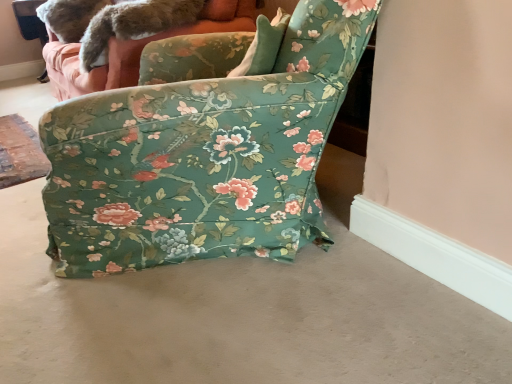
At what (x,y) coordinates should I click in order to perform the action: click on floral fabric couch at upper center. Please return your answer as a coordinate pair (x, y). Image resolution: width=512 pixels, height=384 pixels. Looking at the image, I should click on (x=145, y=45).

Image resolution: width=512 pixels, height=384 pixels. Describe the element at coordinates (237, 317) in the screenshot. I see `beige carpet at lower center` at that location.

You are a GUI agent. You are given a task and a screenshot of the screen. Output one action in this format:
    pyautogui.click(x=<x>, y=<y>)
    Task: Click on the floral fabric couch at upper center
    Image resolution: width=512 pixels, height=384 pixels.
    Given the screenshot: What is the action you would take?
    pyautogui.click(x=145, y=45)

At what (x,y) coordinates should I click in order to perform the action: click on animal behind the floral fabric chair at center. Please return your answer as a coordinate pair (x, y). The height and width of the screenshot is (384, 512). Looking at the image, I should click on (113, 21).

Can you confirm if fuzzy fur tail at upper left is positioned to the right of floral fabric chair at center?

No.

Does fuzzy fur tail at upper left lie behind floral fabric chair at center?

Yes, fuzzy fur tail at upper left is behind floral fabric chair at center.

Could you tell me if fuzzy fur tail at upper left is facing floral fabric chair at center?

No, fuzzy fur tail at upper left does not turn towards floral fabric chair at center.

Considering the relative positions of fuzzy fur tail at upper left and floral fabric couch at upper center in the image provided, is fuzzy fur tail at upper left to the left or to the right of floral fabric couch at upper center?

fuzzy fur tail at upper left is positioned on floral fabric couch at upper center's right side.

From the image's perspective, would you say fuzzy fur tail at upper left is shown under floral fabric couch at upper center?

Yes, from the image's perspective, fuzzy fur tail at upper left is beneath floral fabric couch at upper center.

What's the angular difference between fuzzy fur tail at upper left and floral fabric couch at upper center's facing directions?

The angular difference between fuzzy fur tail at upper left and floral fabric couch at upper center is 10.9 degrees.

At what (x,y) coordinates should I click in order to perform the action: click on couch on the left of the fuzzy fur tail at upper left. Please return your answer as a coordinate pair (x, y). This screenshot has height=384, width=512. Looking at the image, I should click on (145, 45).

Where is `concrete located in front of the fuzzy fur tail at upper left`? The width and height of the screenshot is (512, 384). concrete located in front of the fuzzy fur tail at upper left is located at coordinates (237, 317).

Based on the photo, considering the relative sizes of fuzzy fur tail at upper left and beige carpet at lower center in the image provided, is fuzzy fur tail at upper left shorter than beige carpet at lower center?

In fact, fuzzy fur tail at upper left may be taller than beige carpet at lower center.

Does fuzzy fur tail at upper left appear on the right side of beige carpet at lower center?

Incorrect, fuzzy fur tail at upper left is not on the right side of beige carpet at lower center.

Which is in front, point (157, 2) or point (362, 273)?

The point (362, 273) is closer.

From the image's perspective, relative to floral fabric chair at center, is beige carpet at lower center above or below?

beige carpet at lower center is below floral fabric chair at center.

Can you confirm if beige carpet at lower center is thinner than floral fabric chair at center?

Correct, the width of beige carpet at lower center is less than that of floral fabric chair at center.

Is beige carpet at lower center outside of floral fabric chair at center?

beige carpet at lower center is positioned outside floral fabric chair at center.

Is floral fabric chair at center wider than floral fabric couch at upper center?

Yes, floral fabric chair at center is wider than floral fabric couch at upper center.

Does point (178, 140) appear closer or farther from the camera than point (83, 86)?

Clearly, point (178, 140) is closer to the camera than point (83, 86).

Consider the image. From a real-world perspective, which is physically above, floral fabric chair at center or floral fabric couch at upper center?

From a 3D spatial view, floral fabric chair at center is above.

Between floral fabric couch at upper center and beige carpet at lower center, which one has larger size?

floral fabric couch at upper center.

Is beige carpet at lower center at the back of floral fabric couch at upper center?

No, floral fabric couch at upper center is not facing away from beige carpet at lower center.

How different are the orientations of floral fabric couch at upper center and beige carpet at lower center in degrees?

There is a 94.7-degree angle between the facing directions of floral fabric couch at upper center and beige carpet at lower center.

Is floral fabric couch at upper center touching beige carpet at lower center?

No, floral fabric couch at upper center is not beside beige carpet at lower center.

Considering the relative sizes of beige carpet at lower center and fuzzy fur tail at upper left in the image provided, is beige carpet at lower center wider than fuzzy fur tail at upper left?

Yes.

Where is `animal behind the beige carpet at lower center`? animal behind the beige carpet at lower center is located at coordinates (113, 21).

Is beige carpet at lower center far from fuzzy fur tail at upper left?

beige carpet at lower center is far away from fuzzy fur tail at upper left.

Is beige carpet at lower center situated inside fuzzy fur tail at upper left or outside?

beige carpet at lower center cannot be found inside fuzzy fur tail at upper left.

You are a GUI agent. You are given a task and a screenshot of the screen. Output one action in this format:
    pyautogui.click(x=<x>, y=<y>)
    Task: Click on the animal behind the floral fabric chair at center
    This screenshot has width=512, height=384.
    Given the screenshot: What is the action you would take?
    click(113, 21)

Where is `animal below the floral fabric couch at upper center (from the image's perspective)`? The image size is (512, 384). animal below the floral fabric couch at upper center (from the image's perspective) is located at coordinates (113, 21).

Considering their positions, is fuzzy fur tail at upper left positioned further to floral fabric chair at center than floral fabric couch at upper center?

Among the two, fuzzy fur tail at upper left is located further to floral fabric chair at center.

Looking at the image, which one is located closer to beige carpet at lower center, floral fabric chair at center or floral fabric couch at upper center?

The object closer to beige carpet at lower center is floral fabric chair at center.

Which object lies nearer to the anchor point fuzzy fur tail at upper left, beige carpet at lower center or floral fabric couch at upper center?

Among the two, floral fabric couch at upper center is located nearer to fuzzy fur tail at upper left.

From the image, which object appears to be nearer to floral fabric couch at upper center, fuzzy fur tail at upper left or beige carpet at lower center?

fuzzy fur tail at upper left is positioned closer to the anchor floral fabric couch at upper center.

Looking at the image, which one is located further to beige carpet at lower center, floral fabric couch at upper center or fuzzy fur tail at upper left?

fuzzy fur tail at upper left is further to beige carpet at lower center.

Based on the photo, when comparing their distances from floral fabric couch at upper center, does beige carpet at lower center or floral fabric chair at center seem closer?

floral fabric chair at center lies closer to floral fabric couch at upper center than the other object.

Estimate the real-world distances between objects in this image. Which object is closer to beige carpet at lower center, fuzzy fur tail at upper left or floral fabric couch at upper center?

floral fabric couch at upper center lies closer to beige carpet at lower center than the other object.

From the image, which object appears to be farther from floral fabric couch at upper center, floral fabric chair at center or beige carpet at lower center?

Among the two, beige carpet at lower center is located further to floral fabric couch at upper center.

Where is `animal positioned between floral fabric chair at center and floral fabric couch at upper center from near to far`? This screenshot has height=384, width=512. animal positioned between floral fabric chair at center and floral fabric couch at upper center from near to far is located at coordinates (113, 21).

The image size is (512, 384). I want to click on chair between beige carpet at lower center and fuzzy fur tail at upper left in the front-back direction, so click(x=202, y=149).

The image size is (512, 384). Find the location of `chair between floral fabric couch at upper center and beige carpet at lower center in the vertical direction`. chair between floral fabric couch at upper center and beige carpet at lower center in the vertical direction is located at coordinates (202, 149).

Where is `animal between floral fabric couch at upper center and beige carpet at lower center in the vertical direction`? The height and width of the screenshot is (384, 512). animal between floral fabric couch at upper center and beige carpet at lower center in the vertical direction is located at coordinates tap(113, 21).